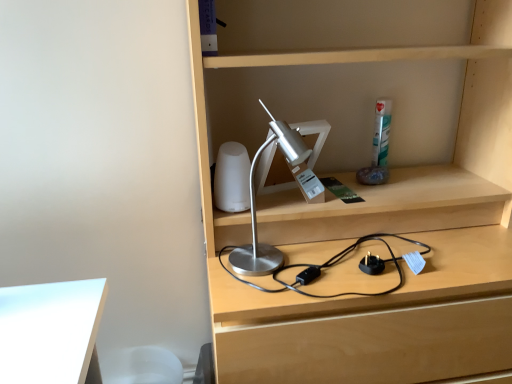
The width and height of the screenshot is (512, 384). Describe the element at coordinates (255, 203) in the screenshot. I see `silver metallic desk lamp at center` at that location.

I want to click on silver metallic desk lamp at center, so [255, 203].

I want to click on silver metallic desk lamp at center, so click(x=255, y=203).